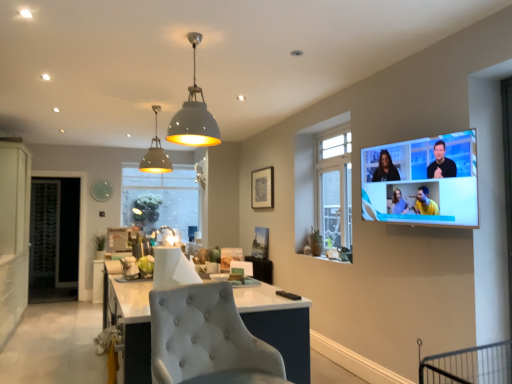
Question: Can you confirm if clear glass door at left is shorter than clear glass window at center, which is the 2th window from front to back?

Choices:
 (A) yes
 (B) no

Answer: (B)

Question: Does clear glass door at left have a larger size compared to clear glass window at center, the second window from the right?

Choices:
 (A) yes
 (B) no

Answer: (A)

Question: Considering the relative sizes of clear glass door at left and clear glass window at center, which is the 1th window in left-to-right order, in the image provided, is clear glass door at left taller than clear glass window at center, which is the 1th window in left-to-right order,?

Choices:
 (A) no
 (B) yes

Answer: (B)

Question: Is the depth of clear glass door at left less than that of clear glass window at center, which ranks as the first window in back-to-front order?

Choices:
 (A) no
 (B) yes

Answer: (B)

Question: From a real-world perspective, is clear glass door at left below clear glass window at center, which is the 1th window in left-to-right order?

Choices:
 (A) no
 (B) yes

Answer: (B)

Question: Is matte black picture frame at upper center inside the boundaries of matte gray pendant light at upper center, or outside?

Choices:
 (A) inside
 (B) outside

Answer: (B)

Question: Considering the positions of matte black picture frame at upper center and matte gray pendant light at upper center in the image, is matte black picture frame at upper center taller or shorter than matte gray pendant light at upper center?

Choices:
 (A) tall
 (B) short

Answer: (B)

Question: In the image, is matte black picture frame at upper center positioned in front of or behind matte gray pendant light at upper center?

Choices:
 (A) behind
 (B) front

Answer: (A)

Question: From the image's perspective, is matte black picture frame at upper center positioned above or below matte gray pendant light at upper center?

Choices:
 (A) above
 (B) below

Answer: (B)

Question: Considering the positions of matte white dome at upper center and flat screen tv at upper right in the image, is matte white dome at upper center wider or thinner than flat screen tv at upper right?

Choices:
 (A) wide
 (B) thin

Answer: (A)

Question: Considering the relative positions of matte white dome at upper center and flat screen tv at upper right in the image provided, is matte white dome at upper center to the left or to the right of flat screen tv at upper right?

Choices:
 (A) left
 (B) right

Answer: (A)

Question: In the image, is matte white dome at upper center positioned in front of or behind flat screen tv at upper right?

Choices:
 (A) front
 (B) behind

Answer: (B)

Question: Considering the positions of point (194, 86) and point (426, 170), is point (194, 86) closer or farther from the camera than point (426, 170)?

Choices:
 (A) closer
 (B) farther

Answer: (B)

Question: Considering the positions of point (132, 190) and point (0, 192), is point (132, 190) closer or farther from the camera than point (0, 192)?

Choices:
 (A) closer
 (B) farther

Answer: (B)

Question: From a real-world perspective, is clear glass window at center, which is the 2th window from front to back, above or below white matte cabinet at left?

Choices:
 (A) above
 (B) below

Answer: (A)